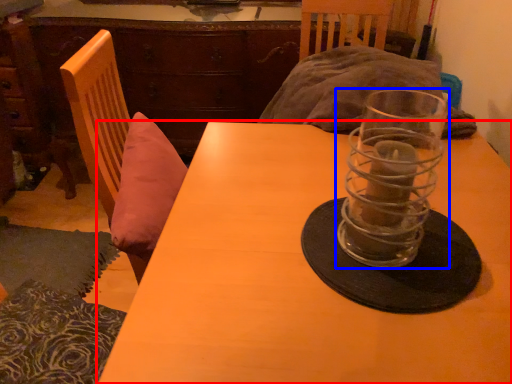
Question: Among these objects, which one is farthest to the camera, table (highlighted by a red box) or tableware (highlighted by a blue box)?

Choices:
 (A) table
 (B) tableware

Answer: (B)